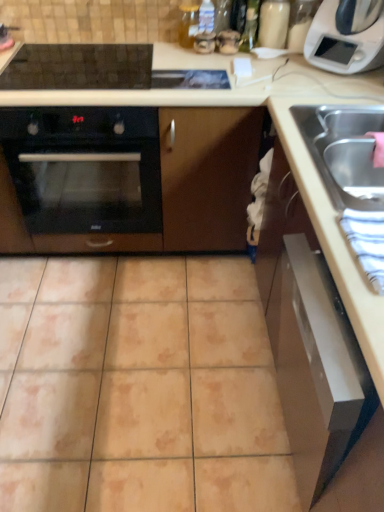
At what (x,y) coordinates should I click in order to perform the action: click on free spot above beige ceramic tile at center (from a real-world perspective). Please return your answer as a coordinate pair (x, y). The image size is (384, 512). Looking at the image, I should click on (122, 351).